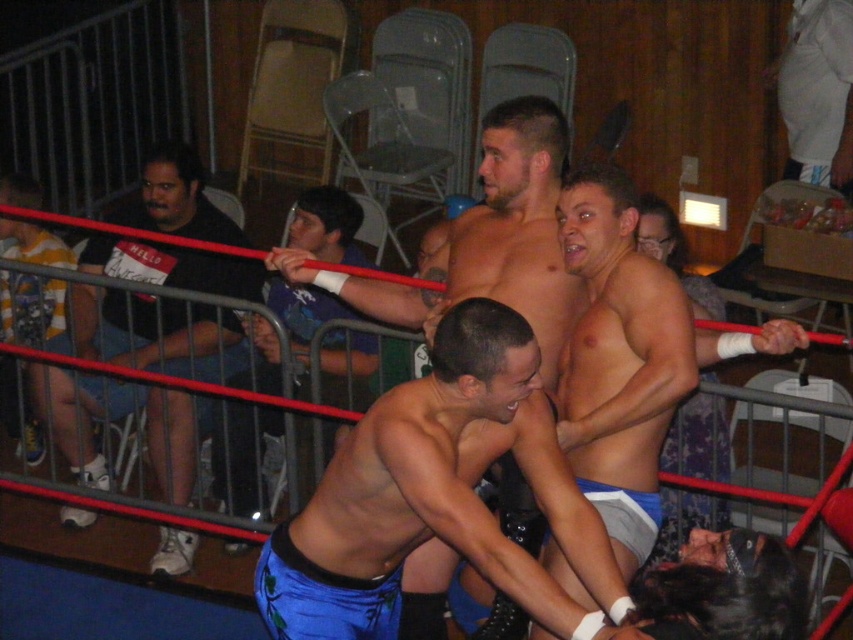
Looking at this image, you are a photographer standing at the back of the venue. You want to take a photo of the smooth skin man at center. What is the best position to aim your camera?

The smooth skin man at center is located at point (439, 497), so aim your camera towards the center slightly to the right and middle to capture him.

You are a photographer in the venue and want to take a clear photo of the shiny blue shorts at center without the smooth skin torso at center blocking it. What should you do?

The smooth skin torso at center is in front of the shiny blue shorts at center, so you should move your position to the side or behind to avoid the obstruction.

You are a photographer trying to capture a closeup shot of the black cotton shirt at left and the shiny blue shorts at center. Since your camera can only focus on one object at a time, which object should you choose to ensure the subject fills the frame more effectively?

The black cotton shirt at left has a larger width than the shiny blue shorts at center, so choosing it would allow the subject to fill the frame more effectively.